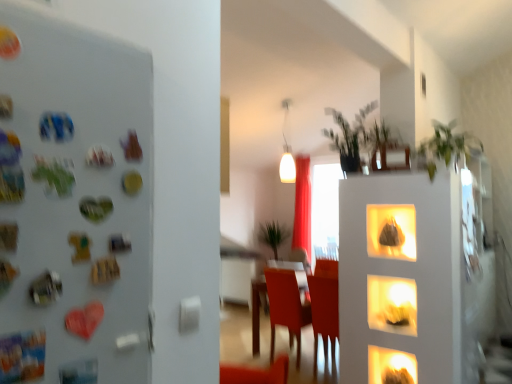
Question: Relative to green leafy plant at upper center, which is counted as the 3th plant, starting from the back, is white glossy lamp at upper center in front or behind?

Choices:
 (A) behind
 (B) front

Answer: (A)

Question: In terms of height, does white glossy lamp at upper center look taller or shorter compared to green leafy plant at upper center, which is counted as the 3th plant, starting from the back?

Choices:
 (A) short
 (B) tall

Answer: (B)

Question: Which of these objects is positioned closest to the green leafy plant at center, placed as the 4th plant when sorted from front to back?

Choices:
 (A) red velvet curtain at center
 (B) green leafy plant at upper center, which ranks as the 2th plant in front-to-back order
 (C) matte plastic chair at center
 (D) white glossy lamp at upper center
 (E) green leafy plant at upper center, which is the second plant from back to front

Answer: (A)

Question: Which object is the farthest from the matte plastic chair at center?

Choices:
 (A) green leafy plant at center, acting as the 1th plant starting from the bottom
 (B) green leafy plant at upper right, the first plant positioned from the front
 (C) green leafy plant at upper center, which ranks as the 2th plant in front-to-back order
 (D) green leafy plant at upper center, which is counted as the first plant, starting from the top
 (E) white glossy lamp at upper center

Answer: (A)